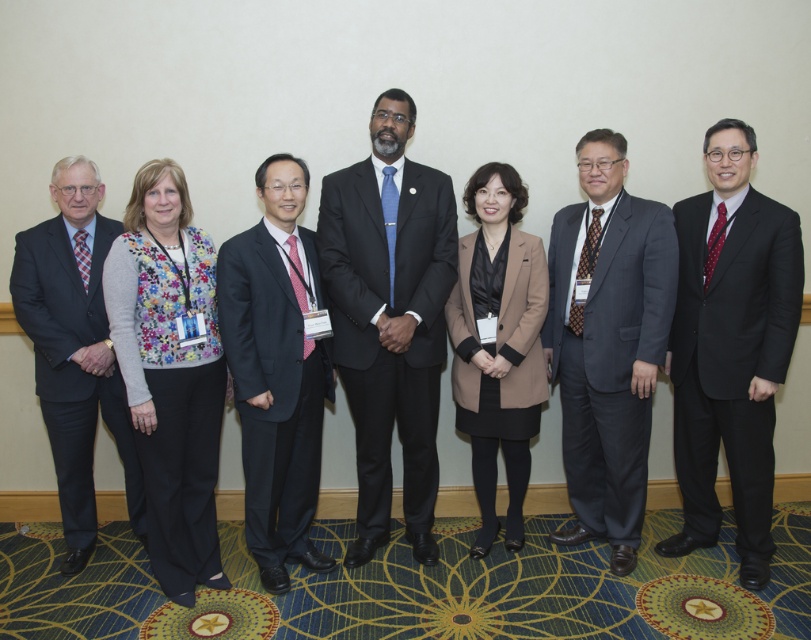
Question: Can you confirm if matte black suit at center is positioned below floral-patterned sweater at center?

Choices:
 (A) yes
 (B) no

Answer: (B)

Question: Is navy wool suit at center to the right of tan fabric coat at center from the viewer's perspective?

Choices:
 (A) yes
 (B) no

Answer: (B)

Question: Which point is farther to the camera?

Choices:
 (A) (108, 412)
 (B) (458, 276)
 (C) (242, 272)
 (D) (599, 129)

Answer: (B)

Question: Can you confirm if black smooth suit at right is bigger than dark gray suit at left?

Choices:
 (A) no
 (B) yes

Answer: (B)

Question: Estimate the real-world distances between objects in this image. Which object is farther from the navy wool suit at center?

Choices:
 (A) floral-patterned sweater at center
 (B) black smooth suit at right
 (C) tan fabric coat at center
 (D) dark gray suit at left

Answer: (B)

Question: Which object is the farthest from the navy wool suit at center?

Choices:
 (A) tan fabric coat at center
 (B) floral-patterned sweater at center

Answer: (A)